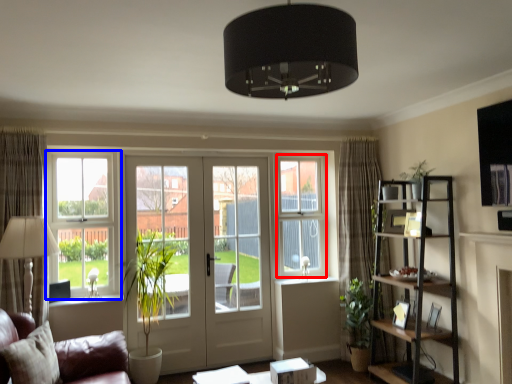
Question: Which object appears farthest to the camera in this image, window screen (highlighted by a red box) or window (highlighted by a blue box)?

Choices:
 (A) window screen
 (B) window

Answer: (A)